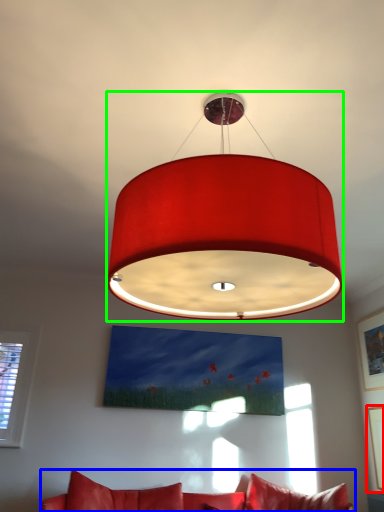
Question: Which object is the farthest from picture frame (highlighted by a red box)? Choose among these: studio couch (highlighted by a blue box) or lamp (highlighted by a green box).

Choices:
 (A) studio couch
 (B) lamp

Answer: (B)